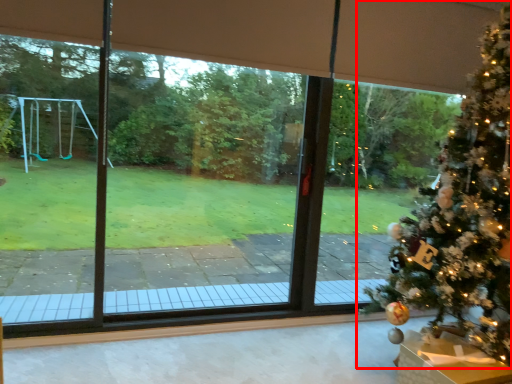
Question: Observing the image, what is the correct spatial positioning of christmas tree (annotated by the red box) in reference to furniture?

Choices:
 (A) left
 (B) right

Answer: (B)